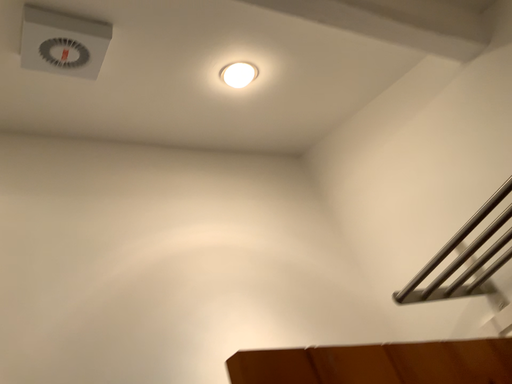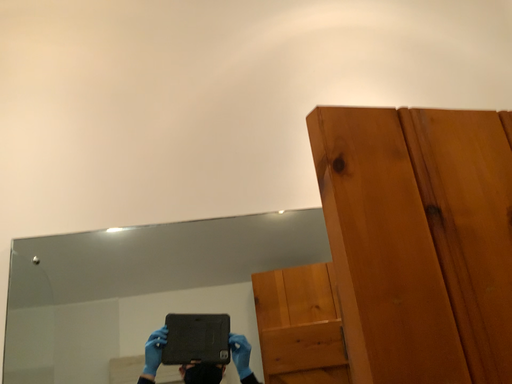
Question: Which way did the camera rotate in the video?

Choices:
 (A) rotated right
 (B) rotated left

Answer: (B)